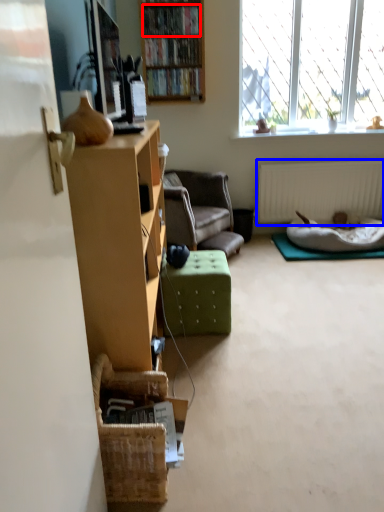
Question: Which point is closer to the camera, book (highlighted by a red box) or radiator (highlighted by a blue box)?

Choices:
 (A) book
 (B) radiator

Answer: (A)